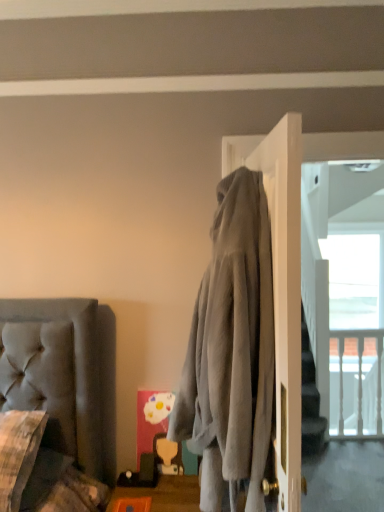
Question: Is gray fabric screen door at upper right shorter than gray fleece hoodie at center?

Choices:
 (A) yes
 (B) no

Answer: (B)

Question: From a real-world perspective, is gray fabric screen door at upper right under gray fleece hoodie at center?

Choices:
 (A) yes
 (B) no

Answer: (B)

Question: Is gray fleece hoodie at center a part of gray fabric screen door at upper right?

Choices:
 (A) no
 (B) yes

Answer: (A)

Question: From the image's perspective, does gray fabric screen door at upper right appear lower than gray fleece hoodie at center?

Choices:
 (A) yes
 (B) no

Answer: (B)

Question: Considering the relative sizes of gray fabric screen door at upper right and gray fleece hoodie at center in the image provided, is gray fabric screen door at upper right smaller than gray fleece hoodie at center?

Choices:
 (A) no
 (B) yes

Answer: (B)

Question: Does gray fabric screen door at upper right lie behind gray fleece hoodie at center?

Choices:
 (A) yes
 (B) no

Answer: (A)

Question: Considering the relative positions of orange plastic tray at lower center and gray fleece hoodie at center in the image provided, is orange plastic tray at lower center to the left of gray fleece hoodie at center from the viewer's perspective?

Choices:
 (A) yes
 (B) no

Answer: (A)

Question: Is orange plastic tray at lower center positioned before gray fleece hoodie at center?

Choices:
 (A) yes
 (B) no

Answer: (B)

Question: Considering the relative sizes of orange plastic tray at lower center and gray fleece hoodie at center in the image provided, is orange plastic tray at lower center smaller than gray fleece hoodie at center?

Choices:
 (A) no
 (B) yes

Answer: (B)

Question: Is orange plastic tray at lower center taller than gray fleece hoodie at center?

Choices:
 (A) no
 (B) yes

Answer: (A)

Question: Is the position of orange plastic tray at lower center more distant than that of gray fleece hoodie at center?

Choices:
 (A) yes
 (B) no

Answer: (A)

Question: From a real-world perspective, is orange plastic tray at lower center on gray fleece hoodie at center?

Choices:
 (A) no
 (B) yes

Answer: (A)

Question: Considering the relative sizes of plush gray couch at lower left and gray fabric screen door at upper right in the image provided, is plush gray couch at lower left thinner than gray fabric screen door at upper right?

Choices:
 (A) no
 (B) yes

Answer: (A)